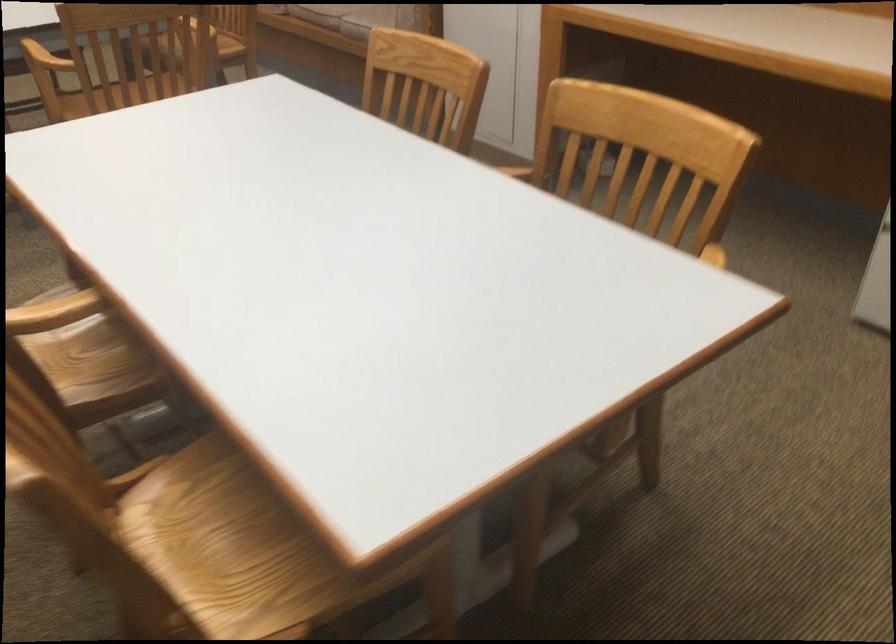
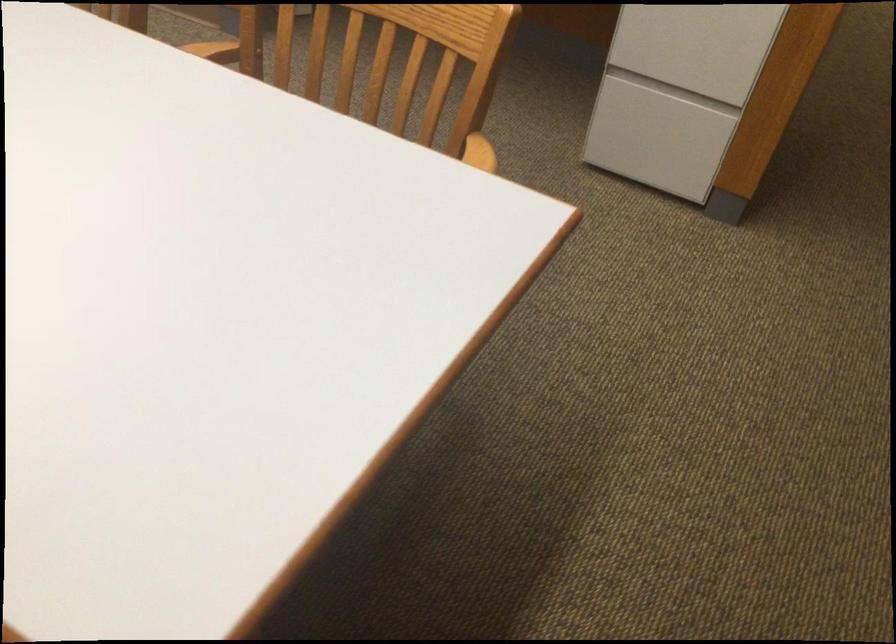
Question: Which direction would the cameraman need to move to produce the second image? Reply with the corresponding letter.

Choices:
 (A) Left
 (B) Right
 (C) Forward
 (D) Backward

Answer: (C)